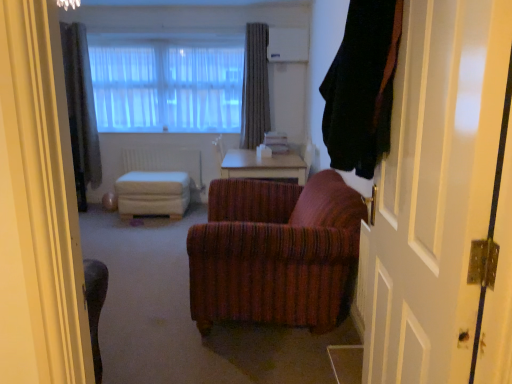
Question: Can you confirm if light brown wooden table at center is smaller than translucent fabric at upper center?

Choices:
 (A) no
 (B) yes

Answer: (A)

Question: Is light brown wooden table at center taller than translucent fabric at upper center?

Choices:
 (A) yes
 (B) no

Answer: (B)

Question: Is light brown wooden table at center positioned far away from translucent fabric at upper center?

Choices:
 (A) yes
 (B) no

Answer: (A)

Question: Is light brown wooden table at center closer to the viewer compared to translucent fabric at upper center?

Choices:
 (A) yes
 (B) no

Answer: (A)

Question: From a real-world perspective, is light brown wooden table at center on top of translucent fabric at upper center?

Choices:
 (A) no
 (B) yes

Answer: (A)

Question: Is light brown wooden table at center wider than translucent fabric at upper center?

Choices:
 (A) yes
 (B) no

Answer: (A)

Question: Is white painted wood door at right oriented towards light brown wooden table at center?

Choices:
 (A) yes
 (B) no

Answer: (B)

Question: From a real-world perspective, does white painted wood door at right sit lower than light brown wooden table at center?

Choices:
 (A) yes
 (B) no

Answer: (B)

Question: From the image's perspective, is white painted wood door at right under light brown wooden table at center?

Choices:
 (A) yes
 (B) no

Answer: (A)

Question: Considering the relative sizes of white painted wood door at right and light brown wooden table at center in the image provided, is white painted wood door at right taller than light brown wooden table at center?

Choices:
 (A) yes
 (B) no

Answer: (A)

Question: Considering the relative positions of white painted wood door at right and light brown wooden table at center in the image provided, is white painted wood door at right to the left of light brown wooden table at center from the viewer's perspective?

Choices:
 (A) no
 (B) yes

Answer: (A)

Question: From a real-world perspective, is white painted wood door at right over light brown wooden table at center?

Choices:
 (A) no
 (B) yes

Answer: (B)

Question: Does gray textured curtain at upper center, which is counted as the 2th curtain, starting from the right, lie behind white fabric ottoman at center?

Choices:
 (A) yes
 (B) no

Answer: (A)